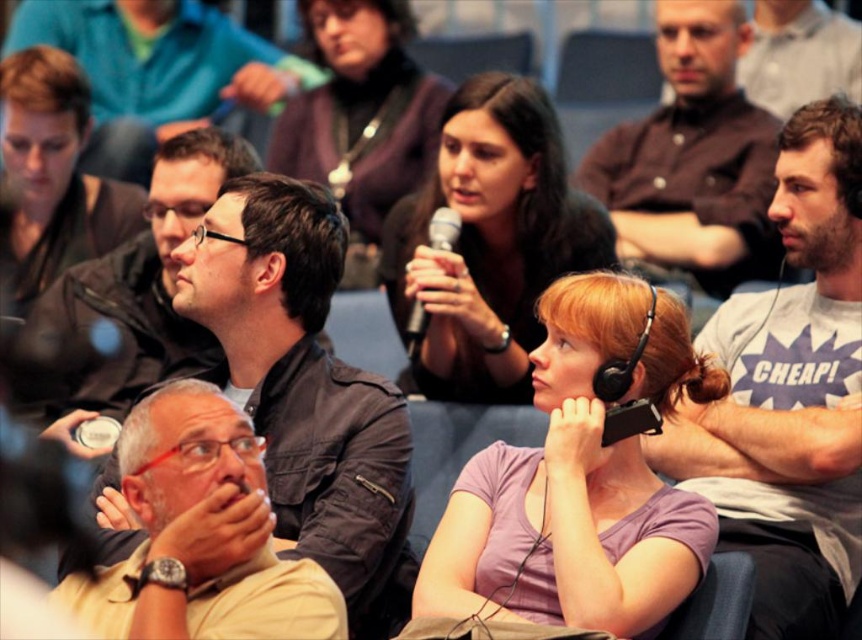
Question: In this image, where is purple matte shirt at center located relative to matte black jacket at upper center?

Choices:
 (A) left
 (B) right

Answer: (B)

Question: Which of these objects is positioned farthest from the metallic silver microphone at center?

Choices:
 (A) matte black microphone at upper center
 (B) purple matte shirt at center
 (C) dark gray leather jacket at upper left
 (D) tan fabric shirt at lower left

Answer: (D)

Question: Which point is farther to the camera?

Choices:
 (A) purple matte shirt at center
 (B) dark brown shirt at upper right

Answer: (B)

Question: Considering the real-world distances, which object is farthest from the matte black jacket at upper center?

Choices:
 (A) matte purple shirt at center
 (B) purple matte shirt at center
 (C) tan fabric shirt at lower left
 (D) matte black shirt at upper center

Answer: (B)

Question: Does purple matte shirt at center have a greater width compared to tan fabric shirt at lower left?

Choices:
 (A) no
 (B) yes

Answer: (B)

Question: Can you confirm if matte black jacket at center is positioned to the left of matte black jacket at upper center?

Choices:
 (A) no
 (B) yes

Answer: (A)